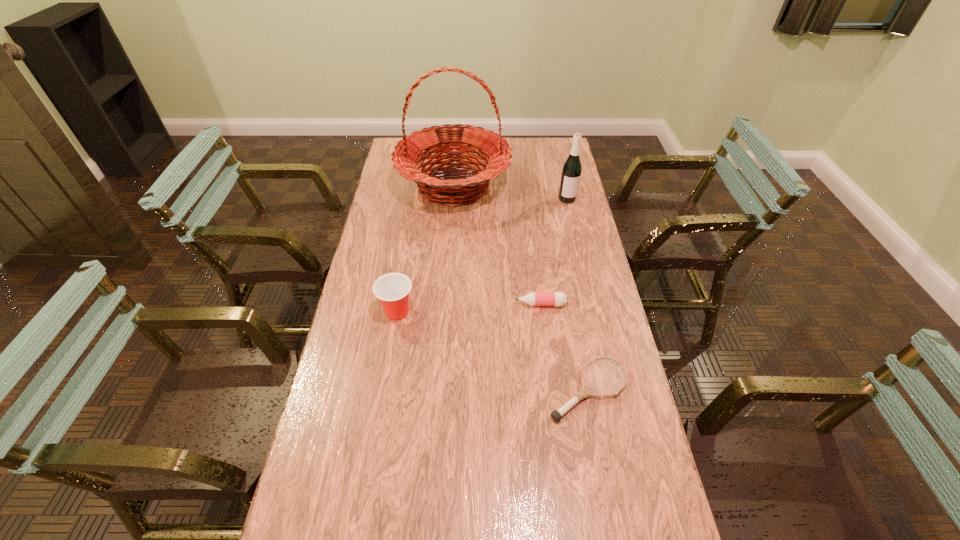
Locate an element on the screen. basket is located at coordinates point(436,188).

Where is `the fourth shortest object`? the fourth shortest object is located at coordinates (571, 172).

The image size is (960, 540). I want to click on the third shortest object, so click(392, 289).

Where is `bottle`? bottle is located at coordinates (558, 299).

Image resolution: width=960 pixels, height=540 pixels. In order to click on the shortest object in this screenshot , I will do `click(585, 391)`.

Identify the location of tennis racket. Image resolution: width=960 pixels, height=540 pixels. tap(585, 391).

Locate an element on the screen. free location located on the front of the tallest object is located at coordinates (446, 292).

You are a GUI agent. You are given a task and a screenshot of the screen. Output one action in this format:
    pyautogui.click(x=<x>, y=<y>)
    Task: Click on the vacant area located on the label of the fourth shortest object
    This screenshot has width=960, height=540.
    Given the screenshot: What is the action you would take?
    pyautogui.click(x=584, y=270)

Locate an element on the screen. vacant area situated 0.200m on the back of the third tallest object is located at coordinates (407, 256).

Identify the location of free space located 0.400m with the cap open on the bottle. (391, 304).